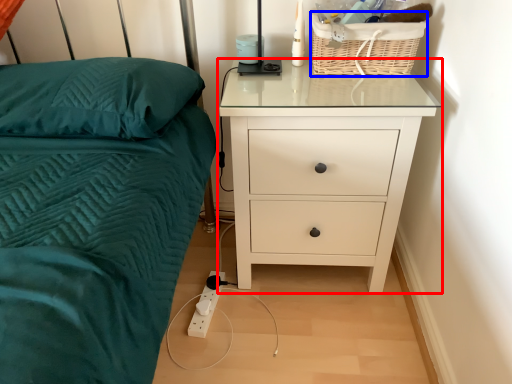
Question: Which object is further to the camera taking this photo, chest of drawers (highlighted by a red box) or basket (highlighted by a blue box)?

Choices:
 (A) chest of drawers
 (B) basket

Answer: (B)